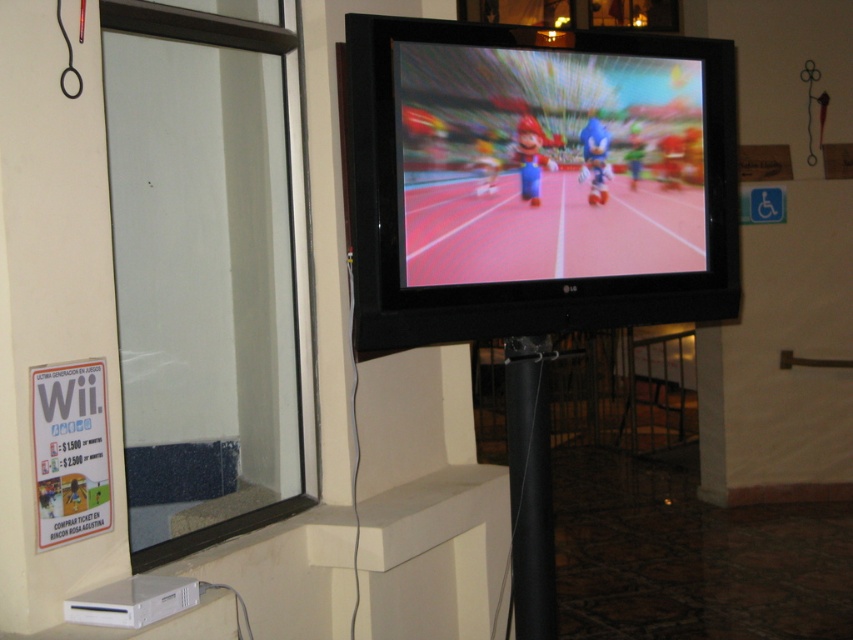
You are a delivery person who needs to hang a new picture frame that is 1.2 meters tall. You see the matte plastic screen at center and the black matte pole at center. Which object is shorter and can accommodate the frame above it without blocking the screen?

The matte plastic screen at center has a lesser height compared to the black matte pole at center, so the frame can be placed above the matte plastic screen at center without blocking it.

You are a technician adjusting the TV mount. The matte plastic screen at center needs to be lowered to align with the window on the left. Can you do this without moving the black matte pole at center?

The matte plastic screen at center is located above the black matte pole at center. Since the pole is fixed, lowering the screen would require adjusting its mount, which is possible as long as the pole remains stable. However, ensure the pole can support the screen at the new position.